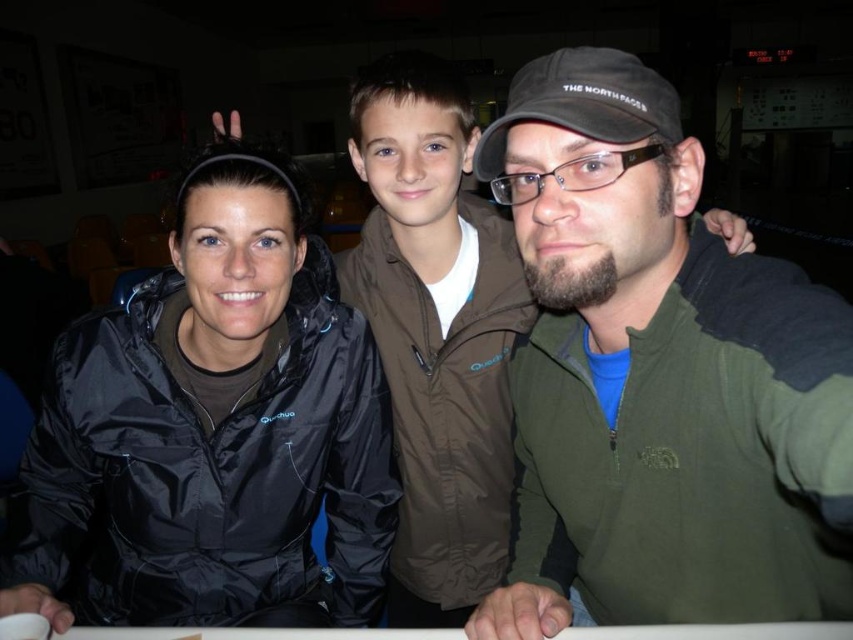
Is green fleece jacket at center wider than black fabric baseball cap at center?

Correct, the width of green fleece jacket at center exceeds that of black fabric baseball cap at center.

Does green fleece jacket at center appear under black fabric baseball cap at center?

Yes.

Identify the location of green fleece jacket at center. The image size is (853, 640). (659, 378).

Is green fleece jacket at center below black matte jacket at center?

No, green fleece jacket at center is not below black matte jacket at center.

Which is in front, point (695, 237) or point (160, 291)?

Positioned in front is point (695, 237).

Between point (622, 464) and point (206, 609), which one is positioned behind?

Positioned behind is point (206, 609).

Where is `green fleece jacket at center`? green fleece jacket at center is located at coordinates (659, 378).

Who is more distant from viewer, (115, 516) or (480, 164)?

Point (115, 516)

Who is positioned more to the right, black matte jacket at center or black fabric baseball cap at center?

black fabric baseball cap at center

The image size is (853, 640). I want to click on black matte jacket at center, so click(213, 426).